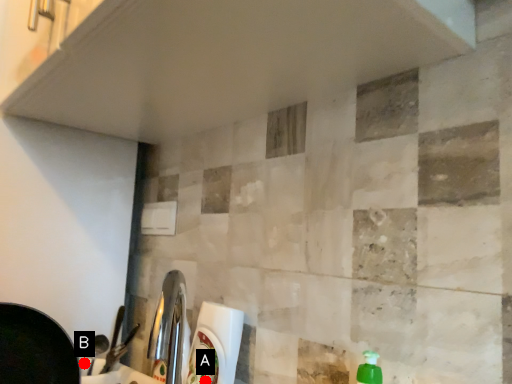
Question: Two points are circled on the image, labeled by A and B beside each circle. Which point appears closest to the camera in this image?

Choices:
 (A) A is closer
 (B) B is closer

Answer: (A)